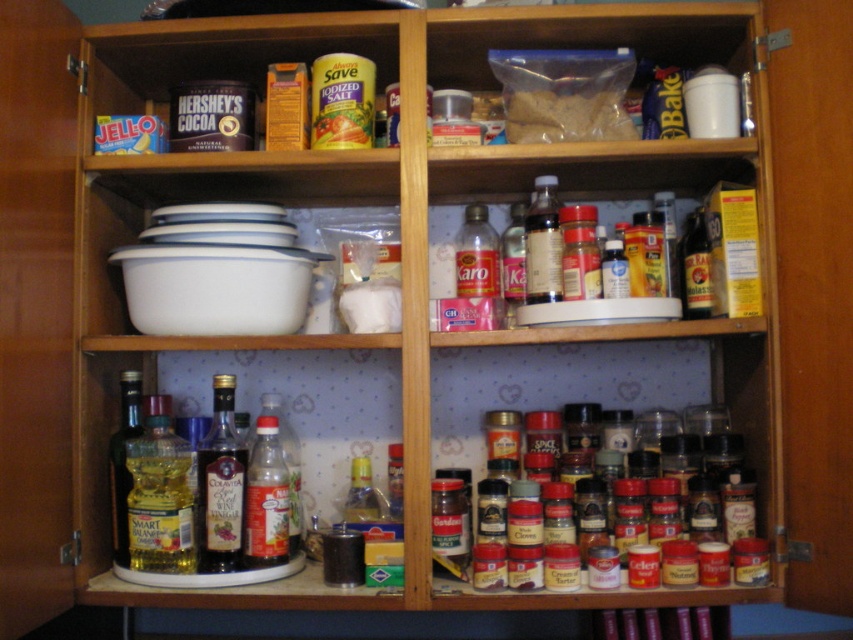
Question: Which object is closer to the camera taking this photo?

Choices:
 (A) shiny dark brown bottle at upper center
 (B) translucent plastic bottle of cooking oil at lower left
 (C) clear glass bottle at center

Answer: (B)

Question: Is dark brown glass bottle at center left positioned behind translucent plastic bottle at lower left?

Choices:
 (A) no
 (B) yes

Answer: (A)

Question: Which of the following is the farthest from the observer?

Choices:
 (A) (245, 483)
 (B) (111, 481)

Answer: (B)

Question: Which object is closer to the camera taking this photo?

Choices:
 (A) dark brown glass bottle at center left
 (B) translucent plastic karo syrup at center

Answer: (A)

Question: Is dark brown glass bottle at center left in front of shiny dark brown bottle at upper center?

Choices:
 (A) no
 (B) yes

Answer: (B)

Question: In this image, where is dark brown glass bottle at center left located relative to shiny dark brown bottle at upper center?

Choices:
 (A) left
 (B) right

Answer: (A)